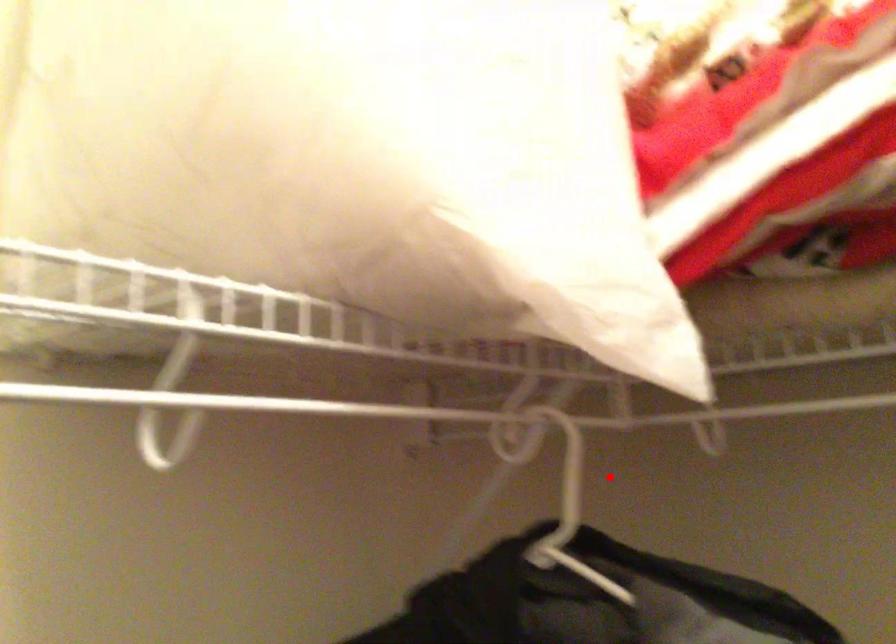
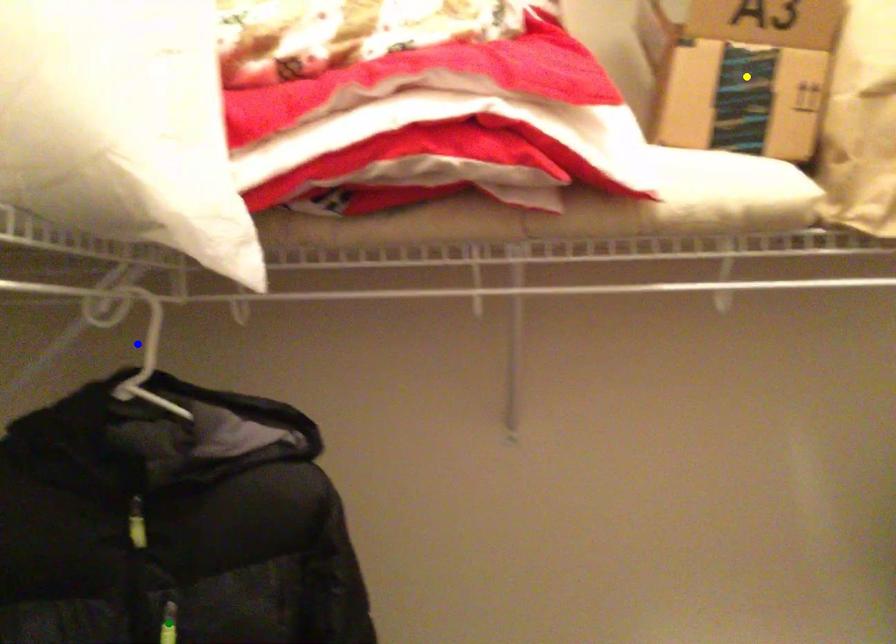
Question: I am providing you with two images of the same scene from different viewpoints. A red point is marked on the first image. You are given multiple points on the second image. Which mark in image 2 goes with the point in image 1?

Choices:
 (A) green point
 (B) yellow point
 (C) blue point

Answer: (C)